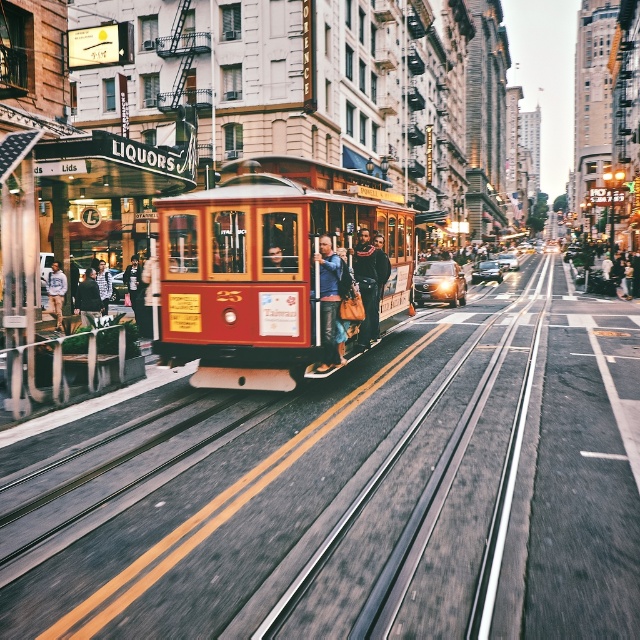
Which is behind, point (372, 337) or point (58, 268)?

The point (58, 268) is more distant.

In order to click on dark brown leather jacket at center in this screenshot , I will do `click(369, 284)`.

What do you see at coordinates (262, 275) in the screenshot? The image size is (640, 640). I see `wooden polished cable car at center` at bounding box center [262, 275].

What do you see at coordinates (262, 275) in the screenshot? The image size is (640, 640). I see `wooden polished cable car at center` at bounding box center [262, 275].

Locate an element on the screen. This screenshot has width=640, height=640. wooden polished cable car at center is located at coordinates (262, 275).

Can you confirm if wooden polished cable car at center is bigger than leather jacket at center?

No.

Does wooden polished cable car at center have a lesser width compared to leather jacket at center?

In fact, wooden polished cable car at center might be wider than leather jacket at center.

Does point (246, 161) come closer to viewer compared to point (339, 256)?

Yes, it is.

The image size is (640, 640). I want to click on wooden polished cable car at center, so click(262, 275).